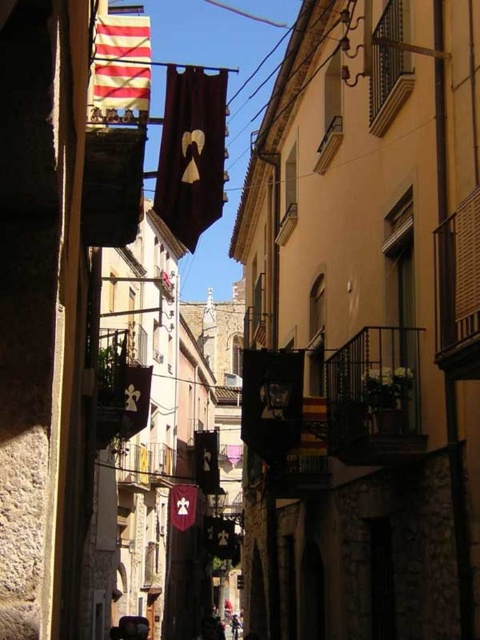
Is dark brown fabric flag at center above striped fabric flag at upper left?

No.

Who is more distant from viewer, [181,225] or [97,72]?

Point [181,225]

Is point (171, 148) less distant than point (105, 16)?

That is True.

This screenshot has width=480, height=640. Identify the location of dark brown fabric flag at center. click(192, 152).

Is dark brown fabric flag at center further to the viewer compared to maroon velvet flag at center?

No, dark brown fabric flag at center is in front of maroon velvet flag at center.

Is point (175, 88) closer to viewer compared to point (193, 518)?

That is True.

Find the location of a particular element. dark brown fabric flag at center is located at coordinates (192, 152).

Locate an element on the screen. dark brown fabric flag at center is located at coordinates (192, 152).

Is striped fabric flag at upper left smaller than maroon velvet flag at center?

No.

Image resolution: width=480 pixels, height=640 pixels. Identify the location of striped fabric flag at upper left. (120, 61).